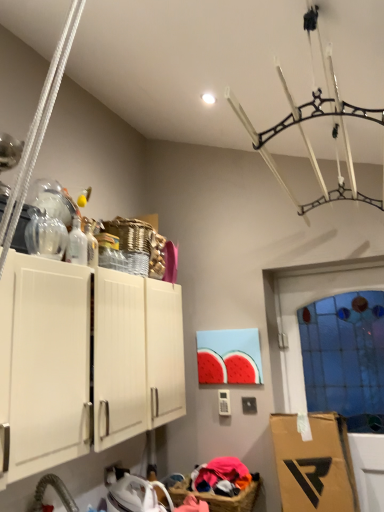
Question: Choose the correct answer: Is transparent glass bottle at upper left, the first bottle viewed from the front, inside transparent glass door at right or outside it?

Choices:
 (A) outside
 (B) inside

Answer: (A)

Question: Looking at their shapes, would you say transparent glass bottle at upper left, the first bottle viewed from the front, is wider or thinner than transparent glass door at right?

Choices:
 (A) wide
 (B) thin

Answer: (A)

Question: Estimate the real-world distances between objects in this image. Which object is closer to the brown wicker basket at lower center?

Choices:
 (A) transparent glass door at right
 (B) transparent glass bottle at upper left, the first bottle viewed from the front
 (C) clear glass bottle at upper left, placed as the 2th bottle when sorted from front to back
 (D) white matte cabinet at upper left

Answer: (D)

Question: Which object is positioned farthest from the transparent glass bottle at upper left, placed as the 2th bottle when sorted from back to front?

Choices:
 (A) brown wicker basket at lower center
 (B) clear glass bottle at upper left, the 1th bottle positioned from the back
 (C) transparent glass door at right
 (D) white matte cabinet at upper left

Answer: (C)